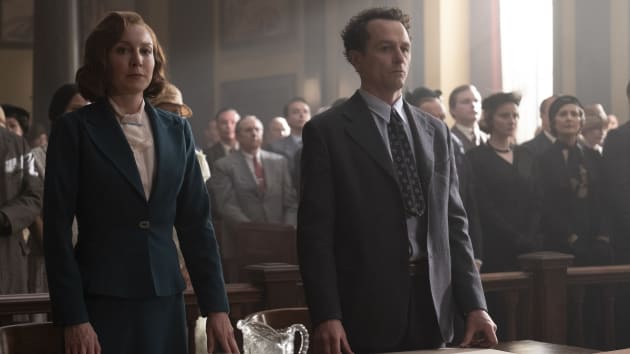
Where is `paper/folder in front of him`? Image resolution: width=630 pixels, height=354 pixels. paper/folder in front of him is located at coordinates (467, 349).